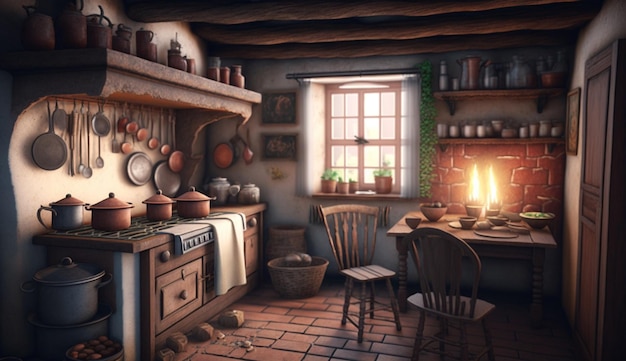
Identify the location of further wall. (285, 207).